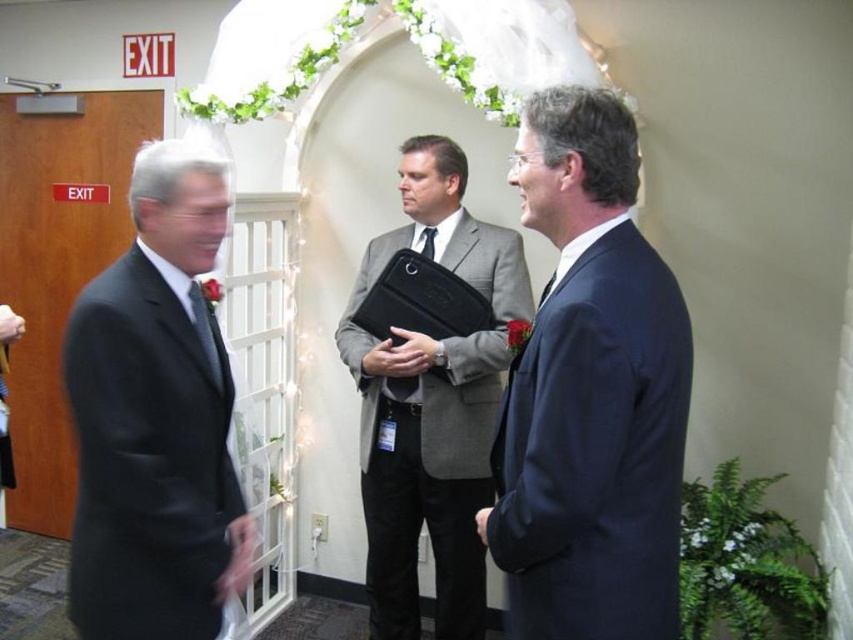
Does gray wool suit at center appear on the left side of black silk tie at center?

Indeed, gray wool suit at center is positioned on the left side of black silk tie at center.

Can you confirm if gray wool suit at center is taller than black silk tie at center?

Indeed, gray wool suit at center has a greater height compared to black silk tie at center.

Is point (471, 596) more distant than point (422, 230)?

No.

At what (x,y) coordinates should I click in order to perform the action: click on gray wool suit at center. Please return your answer as a coordinate pair (x, y). This screenshot has width=853, height=640. Looking at the image, I should click on (432, 404).

Is navy blue suit at center bigger than matte black tie at left?

Yes.

Can you confirm if navy blue suit at center is shorter than matte black tie at left?

Incorrect, navy blue suit at center's height does not fall short of matte black tie at left's.

You are a GUI agent. You are given a task and a screenshot of the screen. Output one action in this format:
    pyautogui.click(x=<x>, y=<y>)
    Task: Click on the navy blue suit at center
    
    Given the screenshot: What is the action you would take?
    pyautogui.click(x=590, y=394)

Is point (223, 400) closer to camera compared to point (198, 307)?

That is True.

Does matte black suit at left have a lesser width compared to matte black tie at left?

No, matte black suit at left is not thinner than matte black tie at left.

Between point (99, 561) and point (213, 358), which one is positioned behind?

Point (213, 358)

I want to click on matte black suit at left, so click(x=155, y=420).